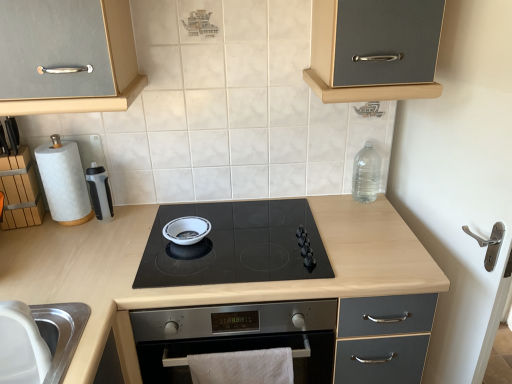
Question: Can you confirm if white cotton towel at lower center is bigger than white glossy bowl at center?

Choices:
 (A) no
 (B) yes

Answer: (B)

Question: Considering the relative positions of white cotton towel at lower center and white glossy bowl at center in the image provided, is white cotton towel at lower center behind white glossy bowl at center?

Choices:
 (A) no
 (B) yes

Answer: (A)

Question: Does white cotton towel at lower center have a greater width compared to white glossy bowl at center?

Choices:
 (A) no
 (B) yes

Answer: (A)

Question: From the image's perspective, is white cotton towel at lower center above white glossy bowl at center?

Choices:
 (A) yes
 (B) no

Answer: (B)

Question: Is white cotton towel at lower center to the left of white glossy bowl at center from the viewer's perspective?

Choices:
 (A) no
 (B) yes

Answer: (A)

Question: From their relative heights in the image, would you say wooden block at left is taller or shorter than stainless steel sink at lower left?

Choices:
 (A) tall
 (B) short

Answer: (A)

Question: From a real-world perspective, is wooden block at left positioned above or below stainless steel sink at lower left?

Choices:
 (A) below
 (B) above

Answer: (B)

Question: Does point (36, 188) appear closer or farther from the camera than point (76, 322)?

Choices:
 (A) closer
 (B) farther

Answer: (B)

Question: In terms of width, does wooden block at left look wider or thinner when compared to stainless steel sink at lower left?

Choices:
 (A) thin
 (B) wide

Answer: (A)

Question: Considering the positions of white glossy bowl at center and black plastic water bottle at left in the image, is white glossy bowl at center taller or shorter than black plastic water bottle at left?

Choices:
 (A) short
 (B) tall

Answer: (A)

Question: From a real-world perspective, is white glossy bowl at center above or below black plastic water bottle at left?

Choices:
 (A) below
 (B) above

Answer: (A)

Question: From the image's perspective, is white glossy bowl at center positioned above or below black plastic water bottle at left?

Choices:
 (A) above
 (B) below

Answer: (B)

Question: Is white glossy bowl at center in front of or behind black plastic water bottle at left in the image?

Choices:
 (A) behind
 (B) front

Answer: (B)

Question: From their relative heights in the image, would you say black glass cooktop at center is taller or shorter than clear plastic bottle at upper right?

Choices:
 (A) short
 (B) tall

Answer: (A)

Question: Is black glass cooktop at center wider or thinner than clear plastic bottle at upper right?

Choices:
 (A) thin
 (B) wide

Answer: (B)